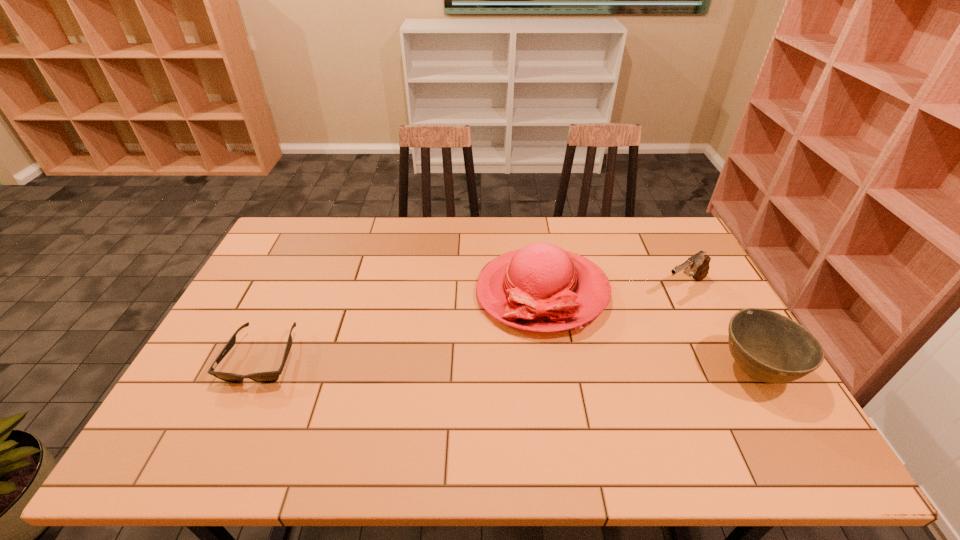
Find the location of a particular element. free location located at the front of the second object from left to right with a bow is located at coordinates (481, 332).

Locate an element on the screen. The image size is (960, 540). vacant region located 0.260m at the front of the second object from left to right with a bow is located at coordinates (420, 373).

This screenshot has width=960, height=540. What are the coordinates of `vacant space located 0.210m at the front of the second object from left to right with a bow` in the screenshot? It's located at (436, 363).

Locate an element on the screen. Image resolution: width=960 pixels, height=540 pixels. object that is at the far edge is located at coordinates (540, 288).

Locate an element on the screen. sunglasses located at the near edge is located at coordinates (263, 377).

Locate an element on the screen. bowl present at the near edge is located at coordinates (769, 347).

The height and width of the screenshot is (540, 960). Find the location of `object at the left edge`. object at the left edge is located at coordinates (263, 377).

What are the coordinates of `bowl that is at the right edge` in the screenshot? It's located at (769, 347).

The image size is (960, 540). I want to click on pistol at the right edge, so click(698, 264).

At what (x,y) coordinates should I click in order to perform the action: click on object at the near left corner. Please return your answer as a coordinate pair (x, y). The height and width of the screenshot is (540, 960). Looking at the image, I should click on (263, 377).